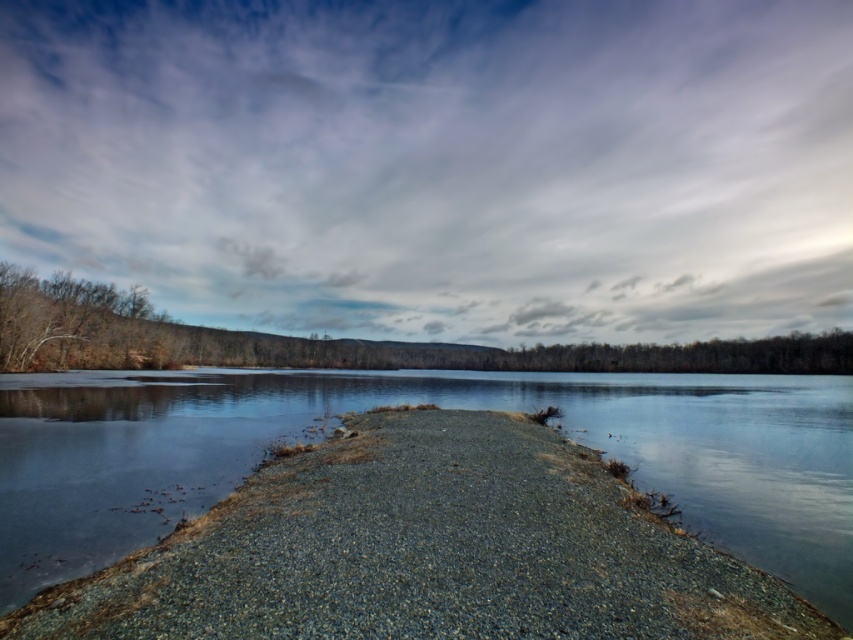
Question: Where is cloudy sky at upper center located in relation to clear water at center in the image?

Choices:
 (A) right
 (B) left

Answer: (B)

Question: Can you confirm if cloudy sky at upper center is positioned to the left of clear water at center?

Choices:
 (A) no
 (B) yes

Answer: (B)

Question: Which point is farther from the camera taking this photo?

Choices:
 (A) (22, 116)
 (B) (613, 442)

Answer: (A)

Question: Among these points, which one is nearest to the camera?

Choices:
 (A) (820, 456)
 (B) (550, 40)

Answer: (A)

Question: Is cloudy sky at upper center above clear water at center?

Choices:
 (A) no
 (B) yes

Answer: (B)